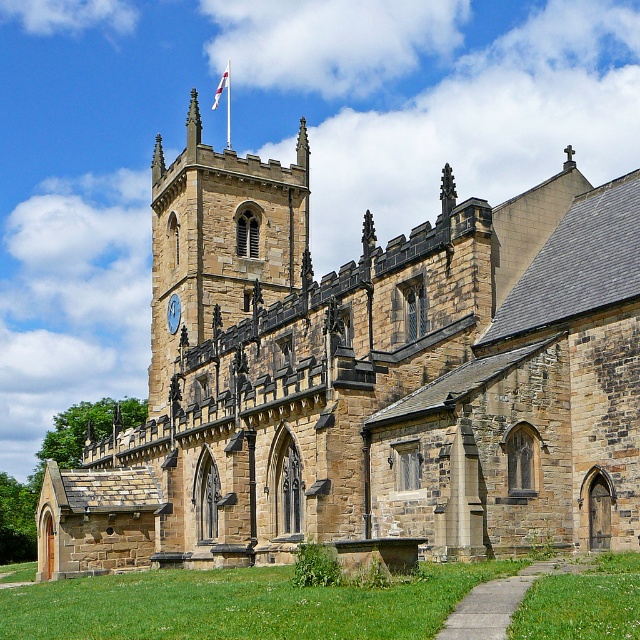
From the picture: You are standing in front of the brown stone church at center and want to take a photo of the stone clock tower at upper center. Since the church is in the way, can you still see the tower through the church?

The brown stone church at center is located below the stone clock tower at upper center, so yes, you can see the tower above the church.

You are standing in front of the brown stone church at center and the blue stone clock at center. Which one has a greater height?

The brown stone church at center is taller than the blue stone clock at center according to the description.

You are standing in front of the brown stone church at center and want to see the blue stone clock at center. Which direction should you look to see the clock?

The blue stone clock at center is positioned above the brown stone church at center, so you should look upward to see it.